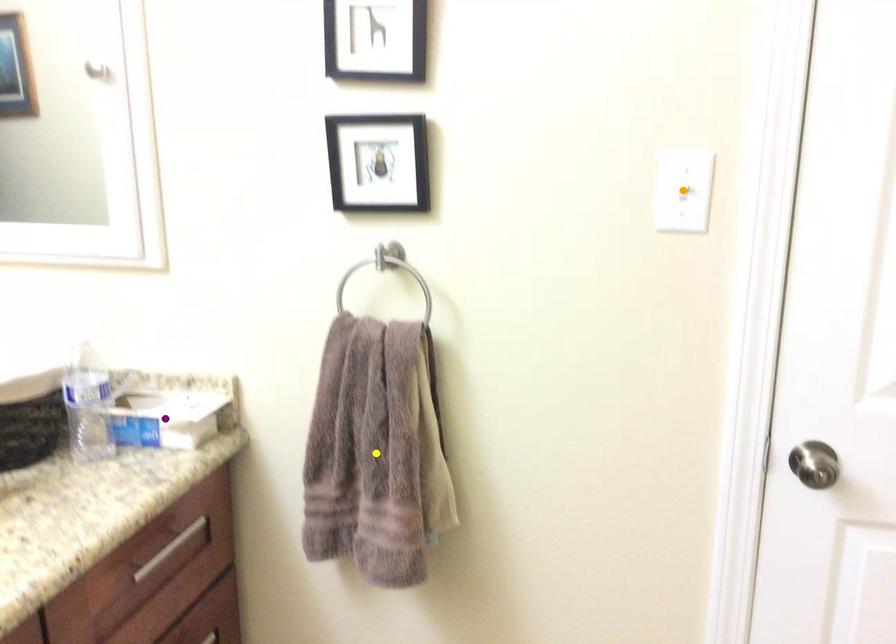
Order these from nearest to farthest:
1. purple point
2. yellow point
3. orange point

1. orange point
2. yellow point
3. purple point